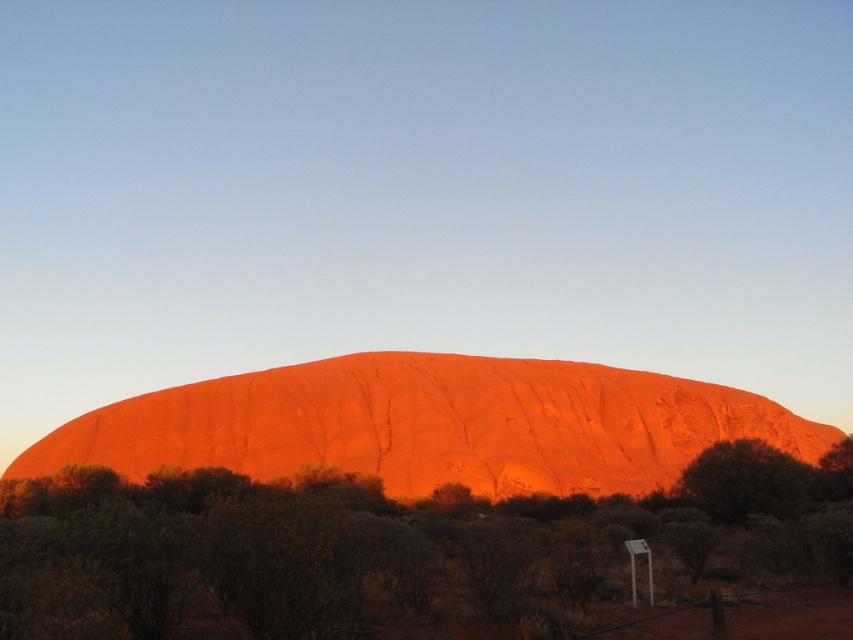
Is the position of matte orange rock at center more distant than that of green leafy bush at lower right?

Yes, matte orange rock at center is behind green leafy bush at lower right.

Is point (352, 449) closer to viewer compared to point (717, 456)?

No, it is not.

Who is more distant from viewer, (490, 435) or (711, 508)?

The point (490, 435) is behind.

Find the location of a particular element. This screenshot has width=853, height=640. matte orange rock at center is located at coordinates 432,426.

Image resolution: width=853 pixels, height=640 pixels. I want to click on green leafy shrub at center, so click(x=386, y=548).

Does green leafy shrub at center have a larger size compared to matte orange rock at center?

Incorrect, green leafy shrub at center is not larger than matte orange rock at center.

Find the location of a particular element. The image size is (853, 640). green leafy shrub at center is located at coordinates (386, 548).

Where is `green leafy shrub at center`? The width and height of the screenshot is (853, 640). green leafy shrub at center is located at coordinates (386, 548).

Does green leafy shrub at center appear on the right side of green leafy bush at lower right?

Incorrect, green leafy shrub at center is not on the right side of green leafy bush at lower right.

Does point (338, 579) come in front of point (724, 474)?

Yes.

Which is behind, point (457, 588) or point (758, 508)?

Positioned behind is point (758, 508).

Where is `green leafy shrub at center`? green leafy shrub at center is located at coordinates (386, 548).